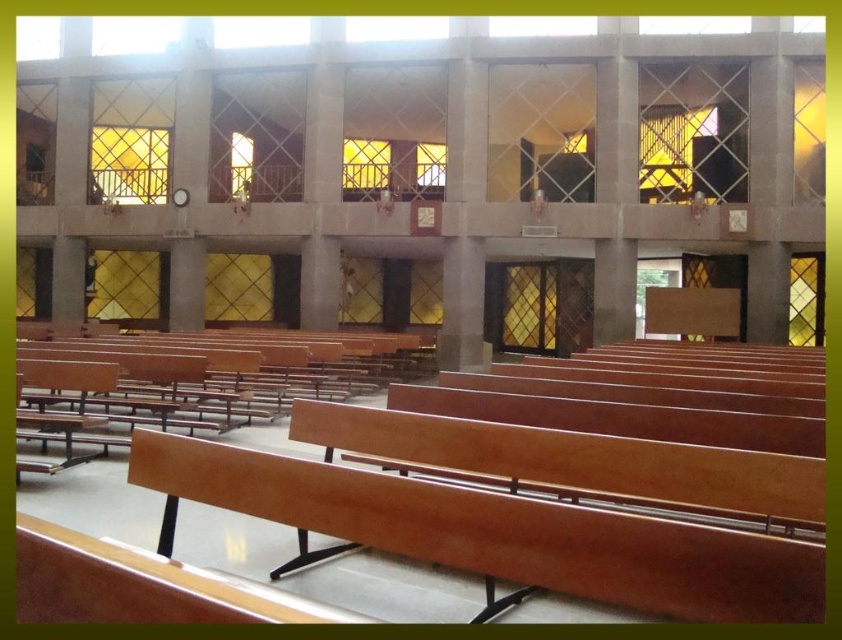
Question: Is wooden church bench at center to the left of wooden bench at center from the viewer's perspective?

Choices:
 (A) yes
 (B) no

Answer: (B)

Question: Is wooden church bench at center smaller than wooden bench at center?

Choices:
 (A) yes
 (B) no

Answer: (B)

Question: Which point appears closest to the camera in this image?

Choices:
 (A) (488, 426)
 (B) (212, 380)

Answer: (A)

Question: Does wooden church bench at center appear on the left side of wooden bench at center?

Choices:
 (A) no
 (B) yes

Answer: (A)

Question: Which object is farther from the camera taking this photo?

Choices:
 (A) wooden church bench at center
 (B) wooden bench at center

Answer: (B)